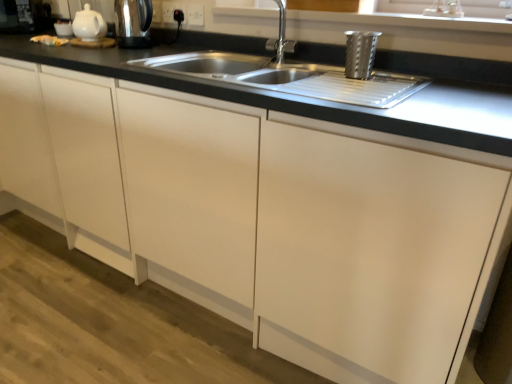
Identify the location of free point above white glossy teapot at upper left (from a real-world perspective). The image size is (512, 384). (87, 6).